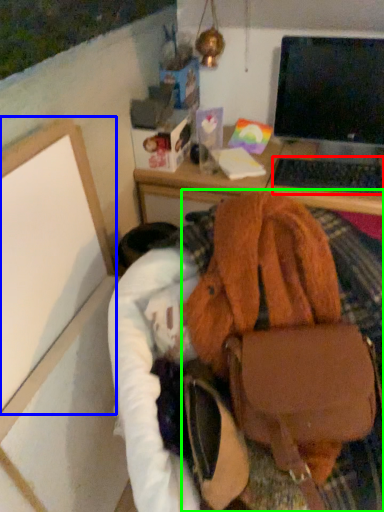
Question: Which object is the farthest from computer keyboard (highlighted by a red box)? Choose among these: bulletin board (highlighted by a blue box) or handbag (highlighted by a green box).

Choices:
 (A) bulletin board
 (B) handbag

Answer: (A)